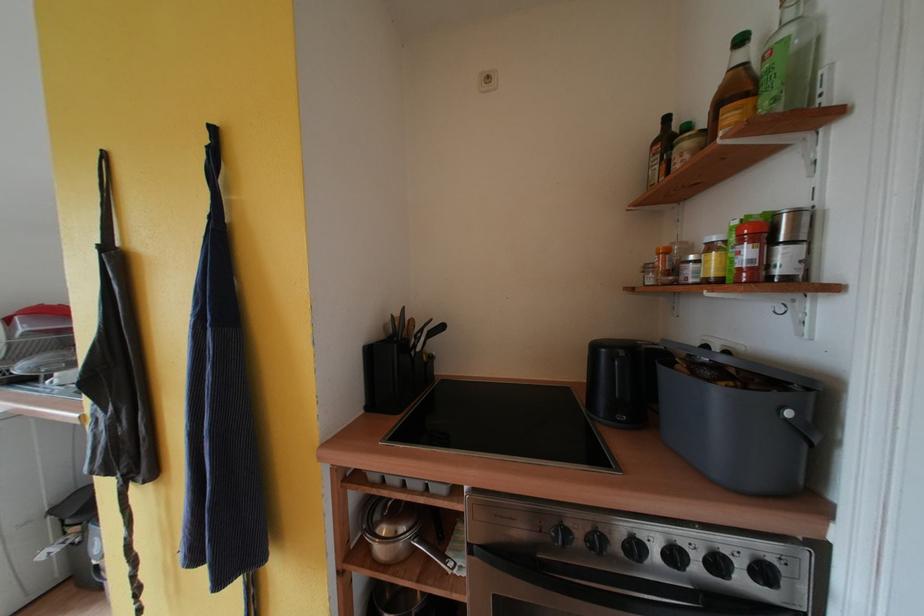
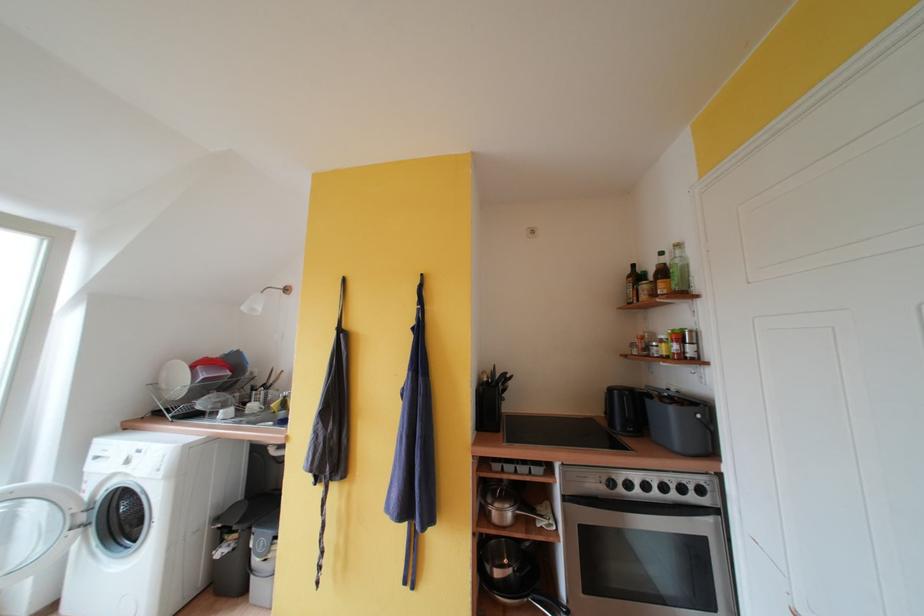
Find the pixel in the second image that matches [661,147] in the first image.

(634, 281)